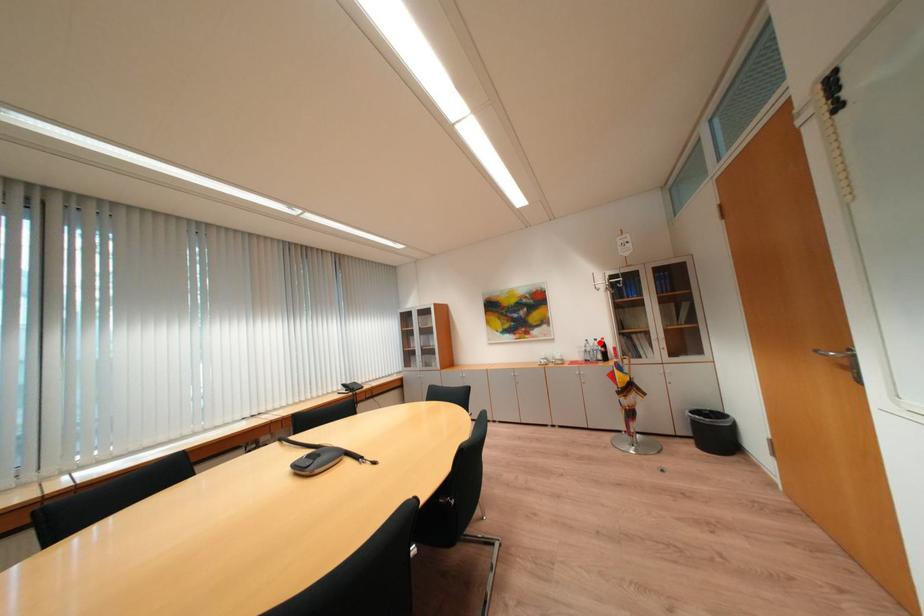
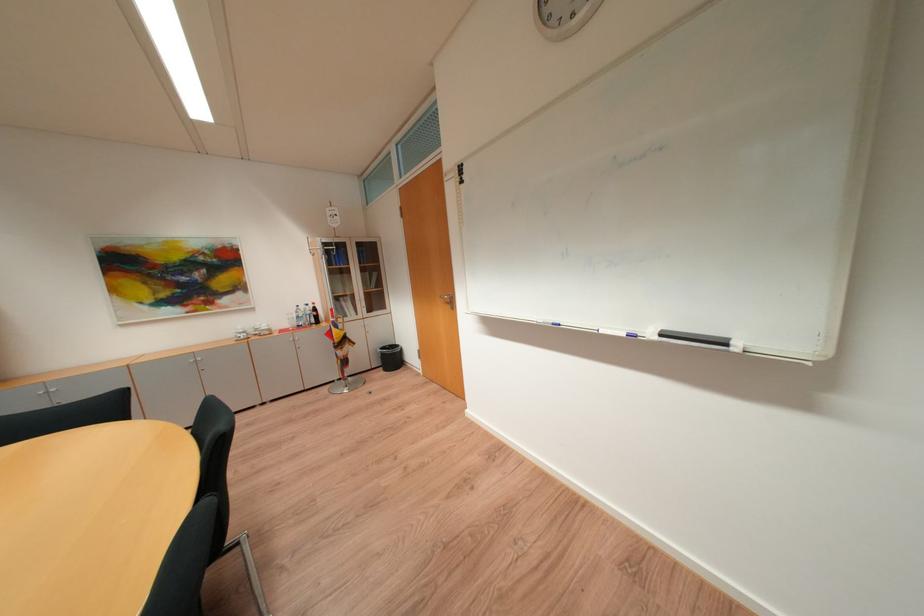
Question: A red point is marked in image1. In image2, is the corresponding 3D point closer to the camera or farther? Reply with the corresponding letter.

Choices:
 (A) The corresponding 3D point is closer.
 (B) The corresponding 3D point is farther.

Answer: (A)